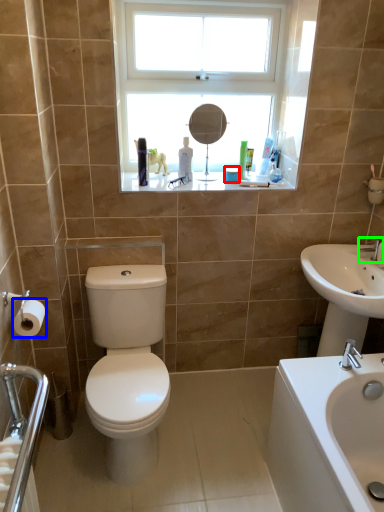
Question: Which object is positioned farthest from toiletry (highlighted by a red box)? Select from toilet paper (highlighted by a blue box) and tap (highlighted by a green box).

Choices:
 (A) toilet paper
 (B) tap

Answer: (A)